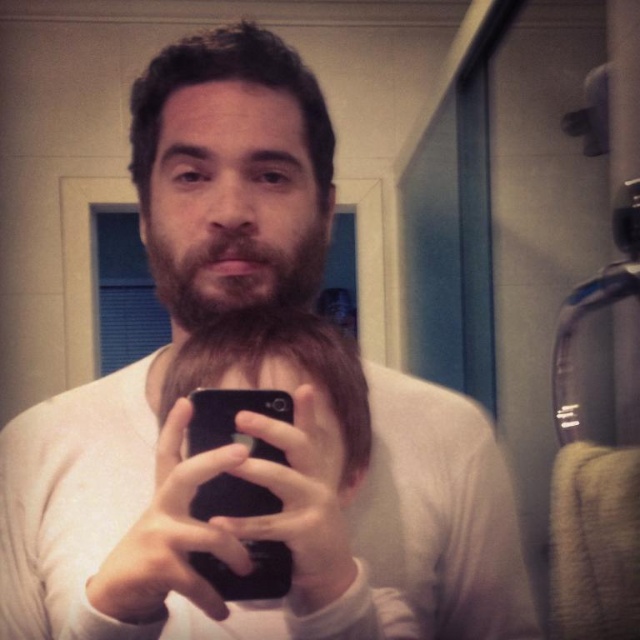
Is black matte phone at center smaller than black matte smartphone at center?

Incorrect, black matte phone at center is not smaller in size than black matte smartphone at center.

Which is more to the left, black matte phone at center or black matte smartphone at center?

From the viewer's perspective, black matte smartphone at center appears more on the left side.

Who is more forward, [300,378] or [212,436]?

Positioned in front is point [212,436].

What are the coordinates of `black matte phone at center` in the screenshot? It's located at (253, 477).

Is point (257, 298) behind point (275, 456)?

Yes, point (257, 298) is farther from viewer.

The width and height of the screenshot is (640, 640). What do you see at coordinates (234, 269) in the screenshot?
I see `brownwoollybeard at center` at bounding box center [234, 269].

Where is `brownwoollybeard at center`? This screenshot has height=640, width=640. brownwoollybeard at center is located at coordinates (234, 269).

Looking at this image, which is more to the right, black matte phone at center or brownwoollybeard at center?

black matte phone at center

Which is in front, point (284, 374) or point (189, 305)?

Point (284, 374)

At what (x,y) coordinates should I click in order to perform the action: click on black matte phone at center. Please return your answer as a coordinate pair (x, y). The image size is (640, 640). Looking at the image, I should click on (253, 477).